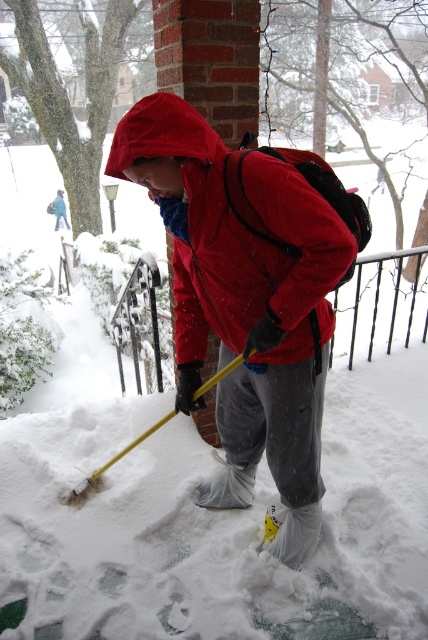
Is matte nylon jacket at center wider than yellow plastic shovel at lower center?

In fact, matte nylon jacket at center might be narrower than yellow plastic shovel at lower center.

Between point (282, 356) and point (133, 449), which one is positioned in front?

Point (282, 356)

Where is `matte nylon jacket at center`? This screenshot has height=640, width=428. matte nylon jacket at center is located at coordinates (297, 244).

Does yellow plastic shovel at lower center appear on the right side of matte black snow shovel at lower left?

Indeed, yellow plastic shovel at lower center is positioned on the right side of matte black snow shovel at lower left.

Can you confirm if yellow plastic shovel at lower center is shorter than matte black snow shovel at lower left?

Yes.

Describe the element at coordinates (113, 461) in the screenshot. The image size is (428, 640). I see `yellow plastic shovel at lower center` at that location.

Where is `yellow plastic shovel at lower center`? This screenshot has height=640, width=428. yellow plastic shovel at lower center is located at coordinates (113, 461).

Which is more to the right, matte nylon jacket at center or matte black snow shovel at lower left?

matte nylon jacket at center

Does matte nylon jacket at center have a lesser width compared to matte black snow shovel at lower left?

Indeed, matte nylon jacket at center has a lesser width compared to matte black snow shovel at lower left.

Is point (262, 218) behind point (58, 209)?

No.

Identify the location of matte nylon jacket at center. (297, 244).